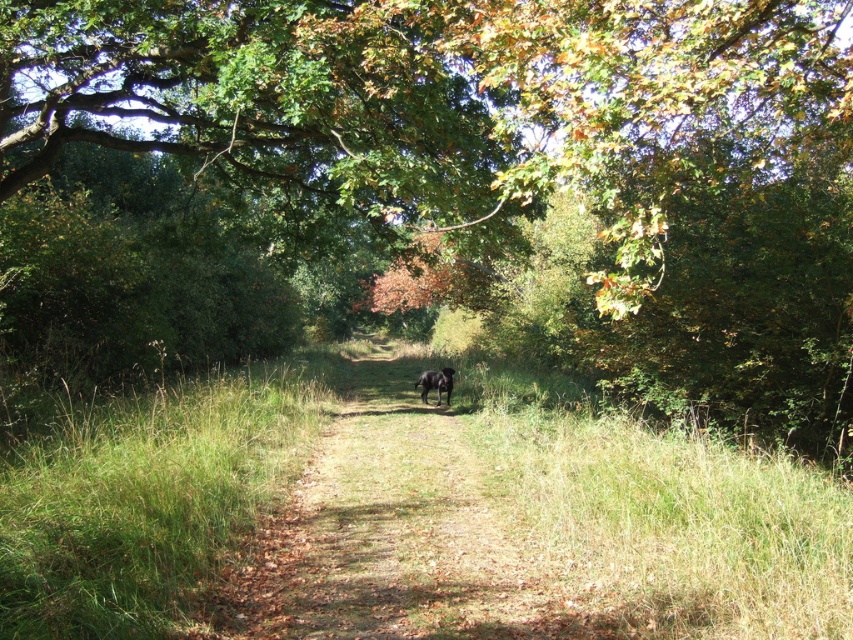
Question: Which of the following is the farthest from the observer?

Choices:
 (A) (180, 451)
 (B) (450, 388)
 (C) (712, 49)

Answer: (B)

Question: Which of the following is the farthest from the observer?

Choices:
 (A) black fur dog at center
 (B) green leafy tree at center

Answer: (A)

Question: Which object appears closest to the camera in this image?

Choices:
 (A) black fur dog at center
 (B) green leafy tree at center
 (C) green grassy at left

Answer: (C)

Question: Is green grassy at left to the right of black fur dog at center from the viewer's perspective?

Choices:
 (A) yes
 (B) no

Answer: (B)

Question: From the image, what is the correct spatial relationship of green leafy tree at center in relation to green grassy at left?

Choices:
 (A) above
 (B) below

Answer: (A)

Question: Where is green leafy tree at center located in relation to green grassy at left in the image?

Choices:
 (A) left
 (B) right

Answer: (B)